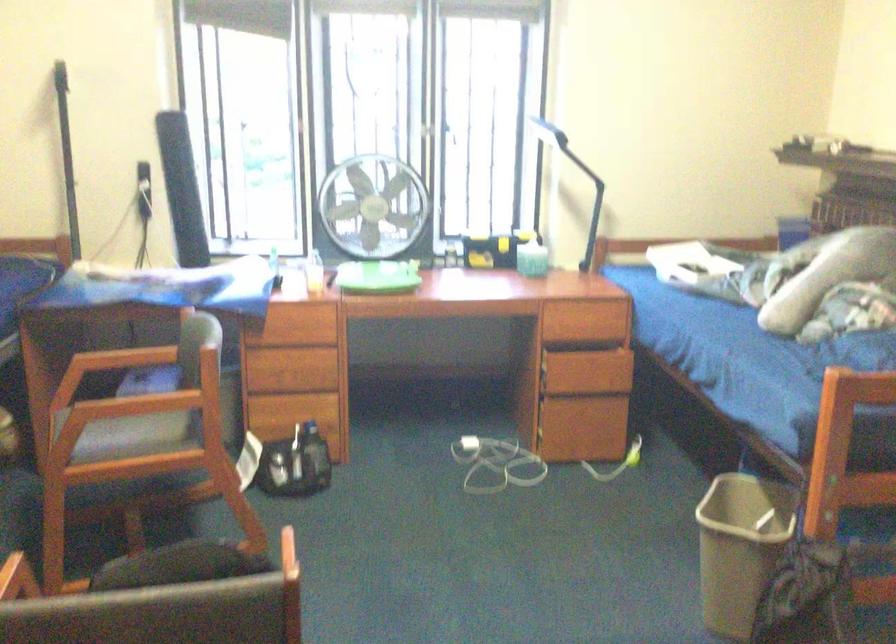
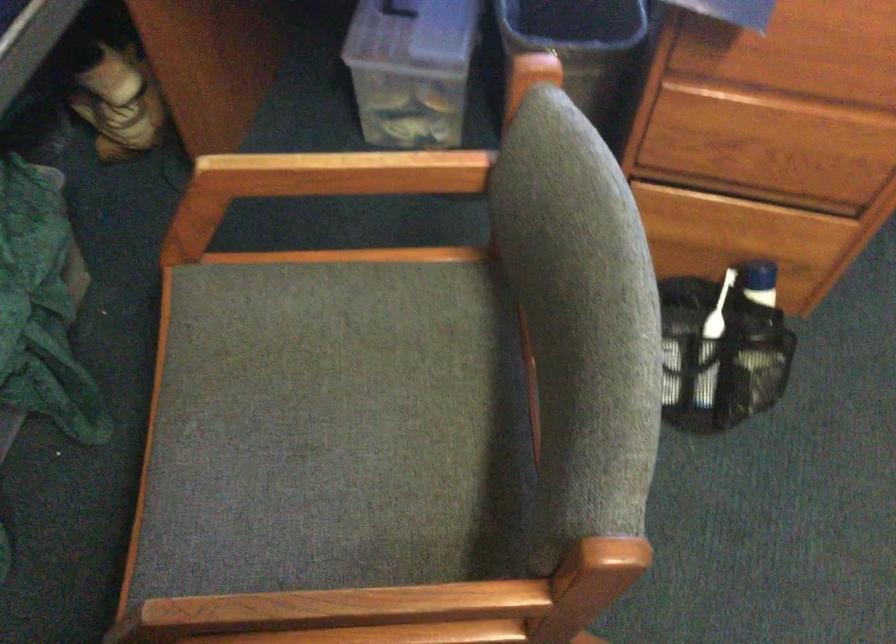
Where in the second image is the point corresponding to the point at 131,431 from the first image?

(347, 406)